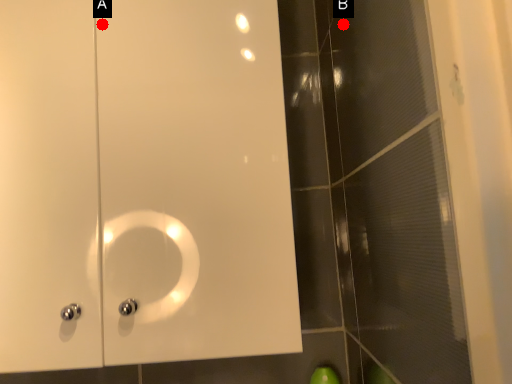
Question: Two points are circled on the image, labeled by A and B beside each circle. Which point is farther to the camera?

Choices:
 (A) A is further
 (B) B is further

Answer: (B)